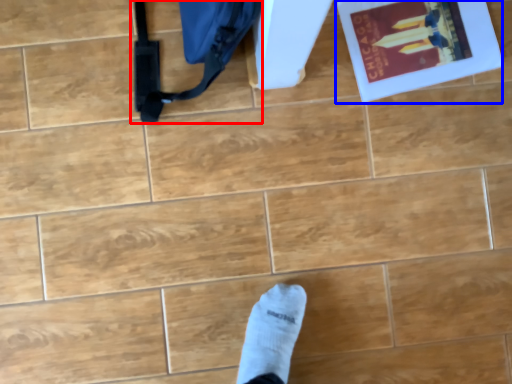
Question: Which of the following is the farthest to the observer, messenger bag (highlighted by a red box) or paperback book (highlighted by a blue box)?

Choices:
 (A) messenger bag
 (B) paperback book

Answer: (B)